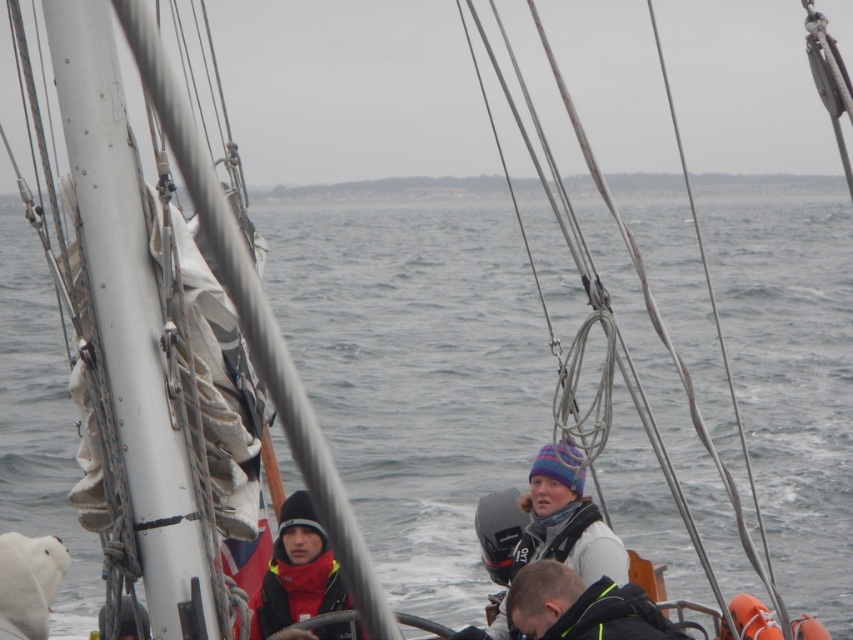
Question: Is striped knit hat at center wider than dark brown leather jacket at lower center?

Choices:
 (A) no
 (B) yes

Answer: (B)

Question: Which object appears farthest from the camera in this image?

Choices:
 (A) dark brown leather jacket at lower center
 (B) striped knit hat at center
 (C) red fleece jacket at lower left

Answer: (C)

Question: Which point is farther to the camera?

Choices:
 (A) dark brown leather jacket at lower center
 (B) red fleece jacket at lower left

Answer: (B)

Question: Is dark brown leather jacket at lower center to the right of red fleece jacket at lower left from the viewer's perspective?

Choices:
 (A) yes
 (B) no

Answer: (A)

Question: Does dark brown leather jacket at lower center have a larger size compared to red fleece jacket at lower left?

Choices:
 (A) yes
 (B) no

Answer: (B)

Question: Which object appears farthest from the camera in this image?

Choices:
 (A) red fleece jacket at lower left
 (B) striped knit hat at center
 (C) dark brown leather jacket at lower center

Answer: (A)